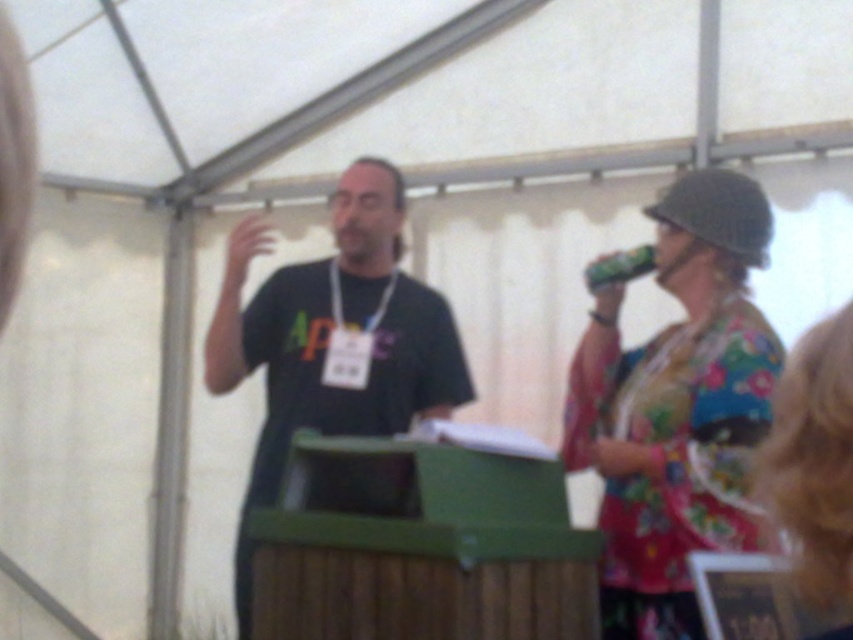
You are standing at the center of the tent and want to locate the floral fabric shirt at upper right. Based on the coordinates provided, in which direction should you look to find it?

The floral fabric shirt at upper right is located at coordinates point (677, 406) which is to the upper right direction from your current position at the center of the tent.

You are a photographer at the event and want to take a photo of the green matte can at upper right without the floral fabric shirt at upper right blocking it. What should you do?

Move to the left side of the scene so that the floral fabric shirt at upper right is no longer in front of the green matte can at upper right. Since the floral fabric shirt at upper right is currently in front, moving left would reposition your viewpoint to see behind the shirt and capture the can unobstructed.

You are standing in front of the white tent structure and see the man in the dark T shirt with the Apple logo. There is also a point marked at coordinates [334,340]. What object is located at that point?

The point at coordinates [334,340] corresponds to the black matte t shirt at center.